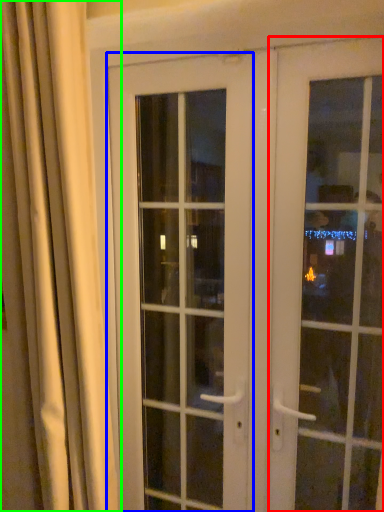
Question: Which object is positioned closest to door (highlighted by a red box)? Select from door (highlighted by a blue box) and curtain (highlighted by a green box).

Choices:
 (A) door
 (B) curtain

Answer: (A)